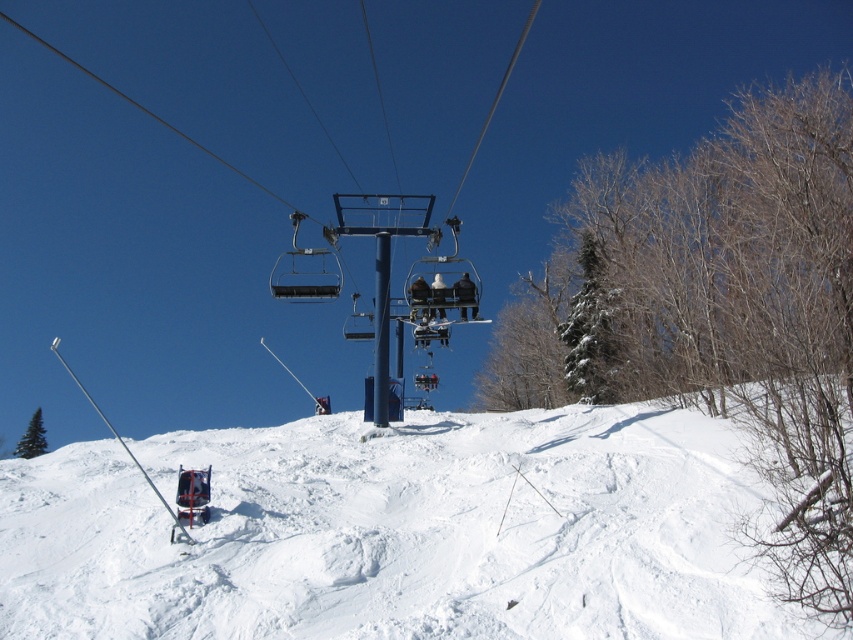
Describe the element at coordinates (463, 289) in the screenshot. I see `dark blue fabric chair at center` at that location.

Between dark blue fabric chair at center and white fabric jacket at center, which one has less height?

With less height is dark blue fabric chair at center.

What are the coordinates of `dark blue fabric chair at center` in the screenshot? It's located at (463, 289).

Can you confirm if white powdery snow at center is taller than dark blue fabric jacket at center?

Yes, white powdery snow at center is taller than dark blue fabric jacket at center.

Can you confirm if white powdery snow at center is positioned below dark blue fabric jacket at center?

Yes, white powdery snow at center is below dark blue fabric jacket at center.

This screenshot has width=853, height=640. In order to click on white powdery snow at center in this screenshot , I will do `click(399, 531)`.

Measure the distance between dark blue fabric chair at center and camera.

The distance of dark blue fabric chair at center from camera is 27.63 meters.

Is the position of dark blue fabric chair at center less distant than that of dark blue fabric jacket at center?

No.

Is point (468, 276) in front of point (427, 312)?

Yes, it is in front of point (427, 312).

The height and width of the screenshot is (640, 853). I want to click on dark blue fabric chair at center, so click(x=463, y=289).